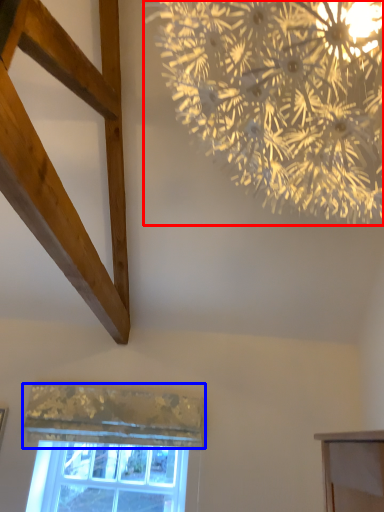
Question: Which point is closer to the camera, flower (highlighted by a red box) or curtain (highlighted by a blue box)?

Choices:
 (A) flower
 (B) curtain

Answer: (A)